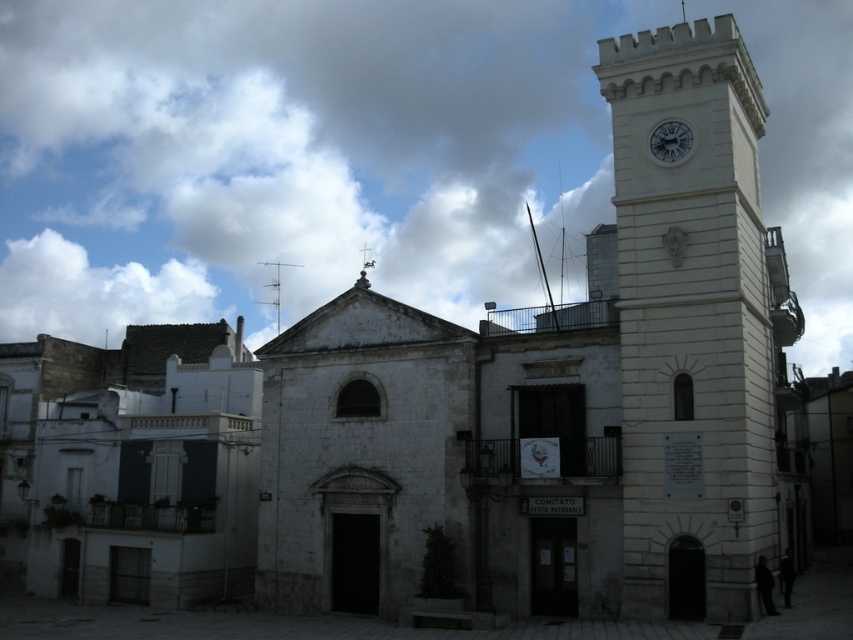
Does white stone clock tower at right have a greater width compared to silver metallic cross at upper center?

Yes.

What do you see at coordinates (693, 323) in the screenshot? I see `white stone clock tower at right` at bounding box center [693, 323].

Image resolution: width=853 pixels, height=640 pixels. Find the location of `white stone clock tower at right`. white stone clock tower at right is located at coordinates (693, 323).

Between white stone clock tower at right and matte white clock at upper right, which one has more height?

white stone clock tower at right is taller.

Does white stone clock tower at right have a greater width compared to matte white clock at upper right?

Yes, white stone clock tower at right is wider than matte white clock at upper right.

Between point (709, 499) and point (674, 138), which one is positioned behind?

The point (674, 138) is more distant.

You are a GUI agent. You are given a task and a screenshot of the screen. Output one action in this format:
    pyautogui.click(x=<x>, y=<y>)
    Task: Click on the white stone clock tower at right
    This screenshot has width=853, height=640.
    Given the screenshot: What is the action you would take?
    pyautogui.click(x=693, y=323)

Can you confirm if matte white clock at upper right is positioned below silver metallic cross at upper center?

Actually, matte white clock at upper right is above silver metallic cross at upper center.

Who is more forward, (662, 128) or (354, 284)?

Point (662, 128) is more forward.

Find the location of a particular element. The height and width of the screenshot is (640, 853). matte white clock at upper right is located at coordinates (670, 141).